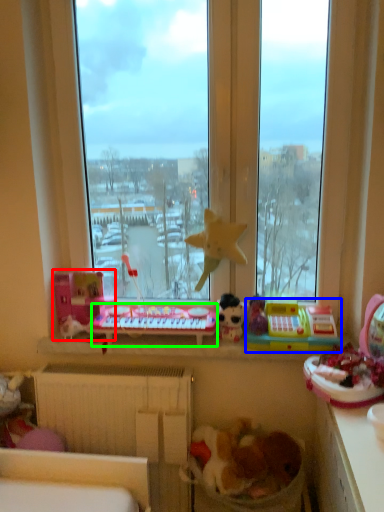
Question: Which is farther away from toy (highlighted by a red box)? toy (highlighted by a blue box) or changing table (highlighted by a green box)?

Choices:
 (A) toy
 (B) changing table

Answer: (A)